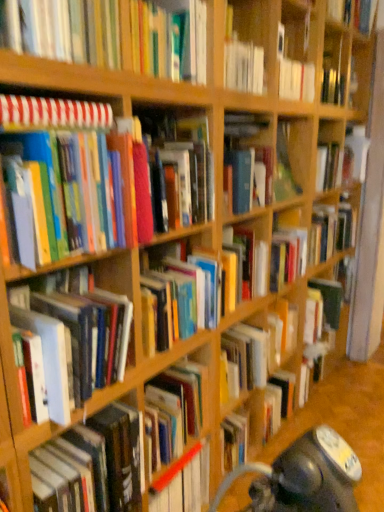
Question: In which direction should I rotate to look at hardcover book at upper center, the 7th book positioned from the bottom?

Choices:
 (A) left
 (B) right

Answer: (A)

Question: Is hardcover book at upper right, arranged as the 1th book when viewed from the top, taller than striped paper notebook at upper left, positioned as the 3th book in top-to-bottom order?

Choices:
 (A) yes
 (B) no

Answer: (A)

Question: Can you confirm if hardcover book at upper right, the eighth book ordered from the bottom, is shorter than striped paper notebook at upper left, positioned as the 3th book in top-to-bottom order?

Choices:
 (A) no
 (B) yes

Answer: (A)

Question: From a real-world perspective, does hardcover book at upper right, arranged as the 1th book when viewed from the top, sit lower than striped paper notebook at upper left, positioned as the 3th book in top-to-bottom order?

Choices:
 (A) no
 (B) yes

Answer: (A)

Question: From the image's perspective, is hardcover book at upper right, the eighth book ordered from the bottom, on striped paper notebook at upper left, positioned as the 3th book in top-to-bottom order?

Choices:
 (A) yes
 (B) no

Answer: (A)

Question: Is hardcover book at upper right, the eighth book ordered from the bottom, in front of striped paper notebook at upper left, positioned as the 3th book in top-to-bottom order?

Choices:
 (A) no
 (B) yes

Answer: (A)

Question: Considering the relative positions of hardcover book at upper right, arranged as the 1th book when viewed from the top, and striped paper notebook at upper left, positioned as the 3th book in top-to-bottom order, in the image provided, is hardcover book at upper right, arranged as the 1th book when viewed from the top, to the left of striped paper notebook at upper left, positioned as the 3th book in top-to-bottom order, from the viewer's perspective?

Choices:
 (A) yes
 (B) no

Answer: (B)

Question: Is hardcover book at left, marked as the first book in a bottom-to-top arrangement, far away from hardcover book at upper right, the eighth book ordered from the bottom?

Choices:
 (A) yes
 (B) no

Answer: (A)

Question: From the image's perspective, is hardcover book at left, which appears as the eighth book when viewed from the top, on top of hardcover book at upper right, the eighth book ordered from the bottom?

Choices:
 (A) yes
 (B) no

Answer: (B)

Question: Considering the relative sizes of hardcover book at left, which appears as the eighth book when viewed from the top, and hardcover book at upper right, the eighth book ordered from the bottom, in the image provided, is hardcover book at left, which appears as the eighth book when viewed from the top, shorter than hardcover book at upper right, the eighth book ordered from the bottom,?

Choices:
 (A) no
 (B) yes

Answer: (A)

Question: From a real-world perspective, is hardcover book at left, which appears as the eighth book when viewed from the top, over hardcover book at upper right, arranged as the 1th book when viewed from the top?

Choices:
 (A) yes
 (B) no

Answer: (B)

Question: From the image's perspective, does hardcover book at left, marked as the first book in a bottom-to-top arrangement, appear lower than hardcover book at upper right, the eighth book ordered from the bottom?

Choices:
 (A) no
 (B) yes

Answer: (B)

Question: Does hardcover book at left, which appears as the eighth book when viewed from the top, have a lesser width compared to hardcover book at upper right, arranged as the 1th book when viewed from the top?

Choices:
 (A) no
 (B) yes

Answer: (A)

Question: Is hardcover book at upper center, arranged as the second book when viewed from the top, turned away from hardcover book at center, positioned as the second book in bottom-to-top order?

Choices:
 (A) no
 (B) yes

Answer: (A)